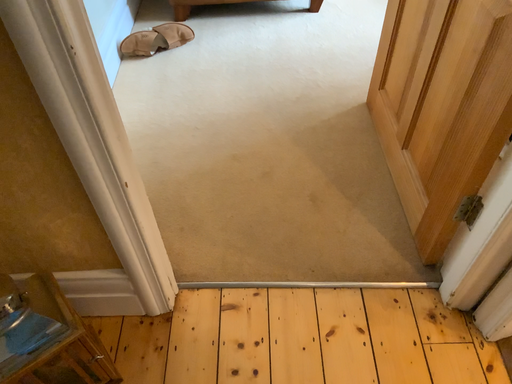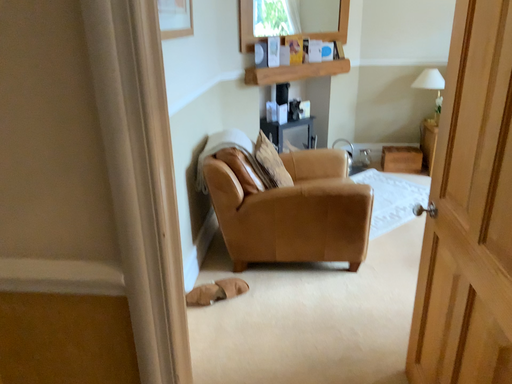
Question: How did the camera likely rotate when shooting the video?

Choices:
 (A) rotated upward
 (B) rotated downward

Answer: (A)